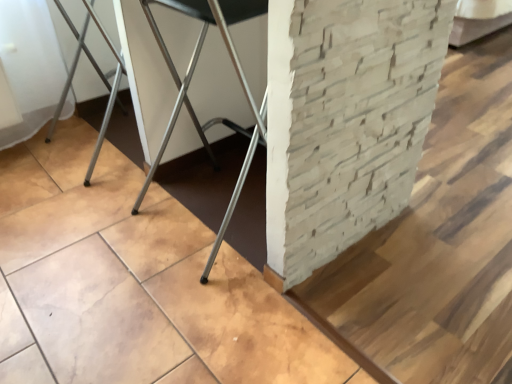
Question: Do you think light beige stone pillar at center is within metallic silver chair at center, or outside of it?

Choices:
 (A) outside
 (B) inside

Answer: (A)

Question: Considering the positions of light beige stone pillar at center and metallic silver chair at center in the image, is light beige stone pillar at center taller or shorter than metallic silver chair at center?

Choices:
 (A) tall
 (B) short

Answer: (B)

Question: From the image's perspective, relative to metallic silver chair at center, is light beige stone pillar at center above or below?

Choices:
 (A) below
 (B) above

Answer: (B)

Question: From a real-world perspective, is metallic silver chair at center positioned above or below light beige stone pillar at center?

Choices:
 (A) below
 (B) above

Answer: (B)

Question: Is metallic silver chair at center inside the boundaries of light beige stone pillar at center, or outside?

Choices:
 (A) inside
 (B) outside

Answer: (B)

Question: Is metallic silver chair at center wider or thinner than light beige stone pillar at center?

Choices:
 (A) thin
 (B) wide

Answer: (A)

Question: Relative to light beige stone pillar at center, is metallic silver chair at center in front or behind?

Choices:
 (A) behind
 (B) front

Answer: (A)